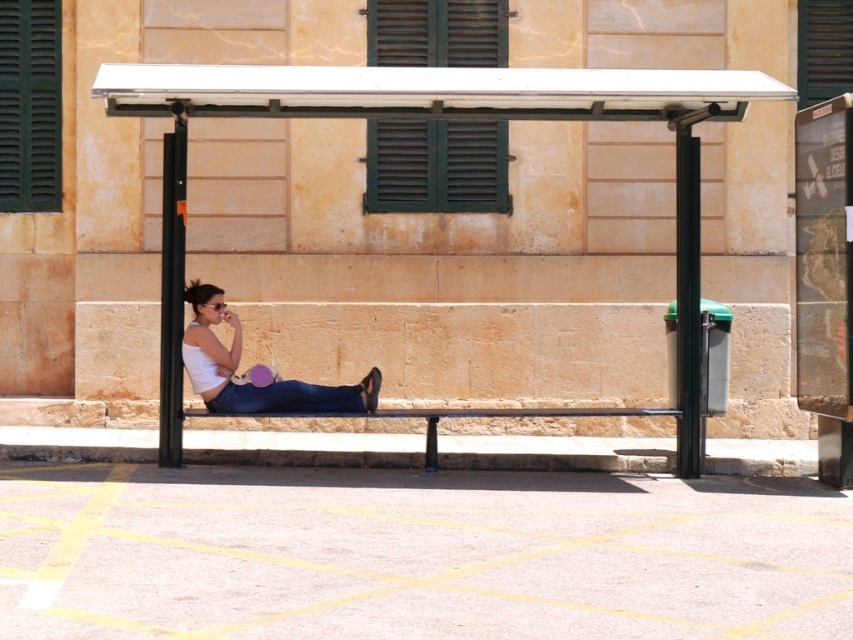
You are at the bus stop and want to sit down. There are two benches available, the white plastic bench at center and the metallic black bench at center. Which bench is closer to you if you are standing at the center of the shelter?

Both the white plastic bench at center and the metallic black bench at center are located at the center of the shelter, so they are equidistant from you. However, the white plastic bench at center is only 4.56 feet away from the metallic black bench at center, meaning they are positioned very close to each other.

You are at the bus stop and want to check the time on the green matte shutter at upper left while sitting on the metallic black bench at center. Can you see the shutter from your seat?

The green matte shutter at upper left is positioned on the left side of metallic black bench at center, so yes, you can see the shutter from your seat on the metallic black bench at center.

You are standing at the bus stop shelter and want to place a small potted plant between the two points marked as point (422, 145) and point (39, 179). Which point should the plant be closer to so that it is positioned in front of the other point?

The plant should be closer to point (39, 179) because point (422, 145) is in front of point (39, 179), so placing the plant near the back point would still keep it in front of the other point.